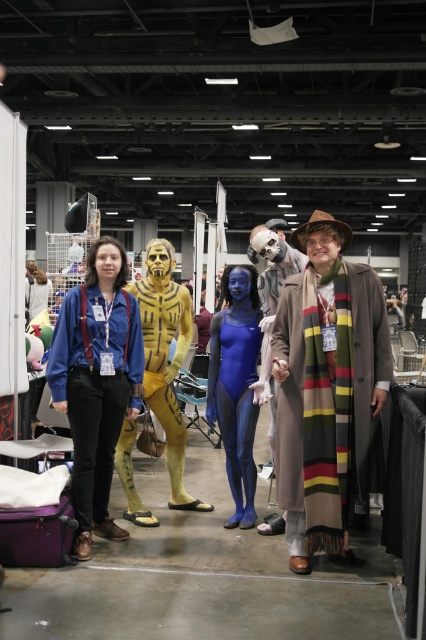
Looking at this image, measure the distance from striped wool scarf at right to yellow matte costume at center.

striped wool scarf at right and yellow matte costume at center are 1.10 meters apart from each other.

The image size is (426, 640). What do you see at coordinates (328, 401) in the screenshot?
I see `striped wool scarf at right` at bounding box center [328, 401].

Where is `striped wool scarf at right`? striped wool scarf at right is located at coordinates (328, 401).

Where is `striped wool scarf at right`? striped wool scarf at right is located at coordinates (328, 401).

Looking at this image, does yellow matte costume at center have a greater height compared to smooth beige coat at center?

Yes.

Does yellow matte costume at center have a lesser height compared to smooth beige coat at center?

No.

In order to click on yellow matte costume at center in this screenshot , I will do `click(166, 356)`.

Is matte blue jeans at center closer to the viewer compared to yellow matte costume at center?

Yes, it is in front of yellow matte costume at center.

Is point (74, 349) behind point (155, 371)?

No, (74, 349) is in front of (155, 371).

Identify the location of matte blue jeans at center. (95, 388).